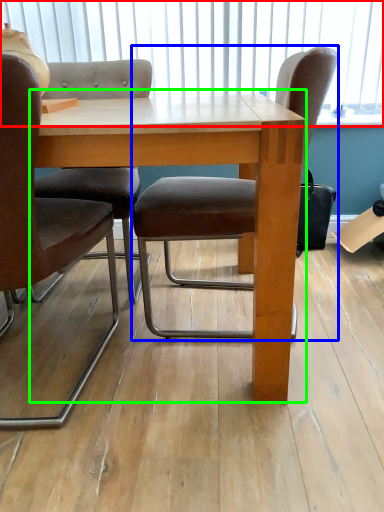
Question: Estimate the real-world distances between objects in this image. Which object is closer to window screen (highlighted by a red box), chair (highlighted by a blue box) or table (highlighted by a green box)?

Choices:
 (A) chair
 (B) table

Answer: (A)